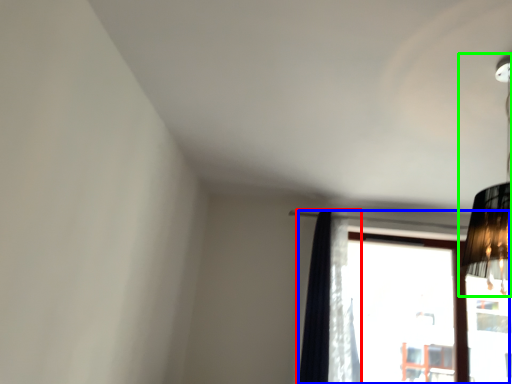
Question: Based on their relative distances, which object is farther from curtain (highlighted by a red box)? Choose from window (highlighted by a blue box) and lamp (highlighted by a green box).

Choices:
 (A) window
 (B) lamp

Answer: (A)